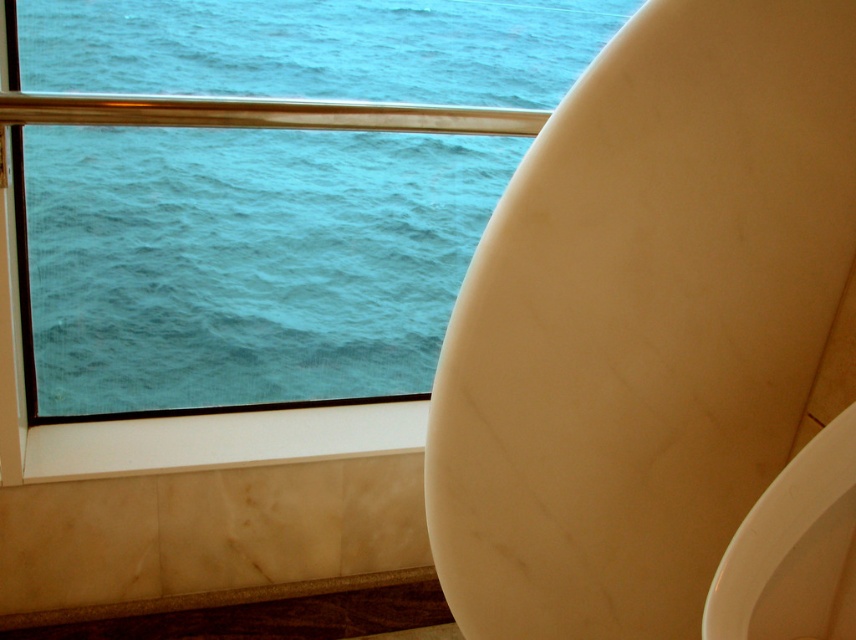
Question: Is white marble urinal at right to the left of white glossy urinal at lower right from the viewer's perspective?

Choices:
 (A) yes
 (B) no

Answer: (A)

Question: Which of the following is the closest to the observer?

Choices:
 (A) (807, 228)
 (B) (129, 113)
 (C) (171, 604)

Answer: (A)

Question: Does blue water at window left appear over metallic gold rail at upper left?

Choices:
 (A) yes
 (B) no

Answer: (A)

Question: Estimate the real-world distances between objects in this image. Which object is closer to the white marble urinal at right?

Choices:
 (A) marble ledge at lower left
 (B) white glossy urinal at lower right
 (C) blue water at window left
 (D) metallic gold rail at upper left

Answer: (B)

Question: Which point appears farthest from the camera in this image?

Choices:
 (A) (319, 632)
 (B) (42, 291)
 (C) (443, 124)
 (D) (715, 573)

Answer: (B)

Question: Observing the image, what is the correct spatial positioning of blue water at window left in reference to metallic gold rail at upper left?

Choices:
 (A) above
 (B) below

Answer: (A)